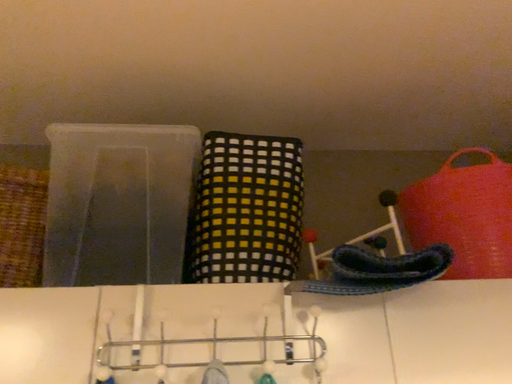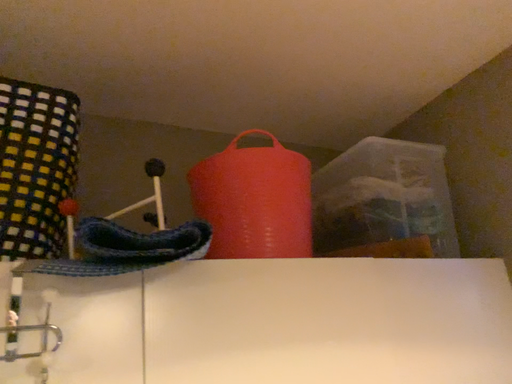
Question: Which way did the camera rotate in the video?

Choices:
 (A) rotated left
 (B) rotated right

Answer: (B)